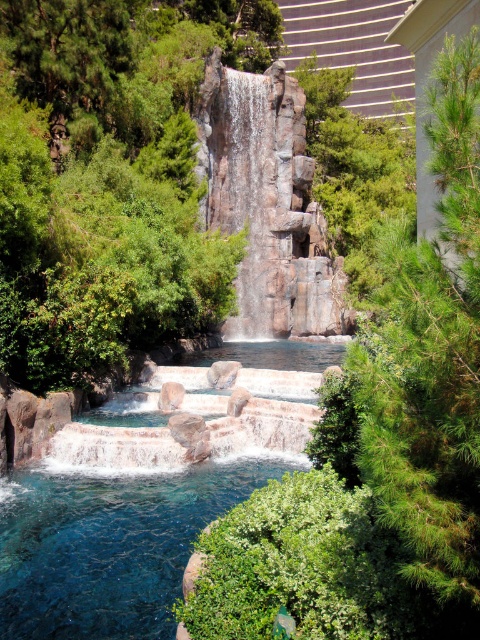
Question: Which point is closer to the camera?

Choices:
 (A) (432, 380)
 (B) (135, 625)

Answer: (A)

Question: Is green needle-like at right to the left of clear blue stone pool at center from the viewer's perspective?

Choices:
 (A) no
 (B) yes

Answer: (A)

Question: Does green needle-like at right have a lesser width compared to clear blue stone pool at center?

Choices:
 (A) yes
 (B) no

Answer: (A)

Question: Can you confirm if green needle-like at right is positioned to the right of clear blue stone pool at center?

Choices:
 (A) yes
 (B) no

Answer: (A)

Question: Which of the following is the farthest from the observer?

Choices:
 (A) (417, 442)
 (B) (116, 600)

Answer: (B)